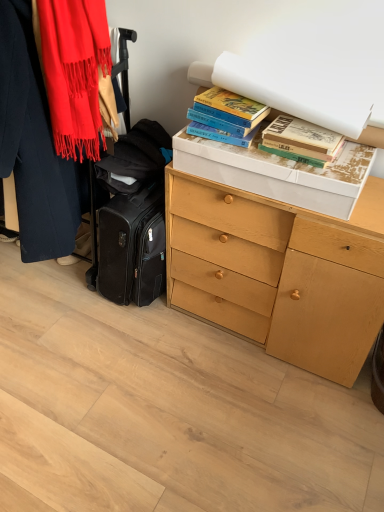
The height and width of the screenshot is (512, 384). Identify the location of free space in front of hardcover books at upper right, the 2th book in the right-to-left sequence. (248, 156).